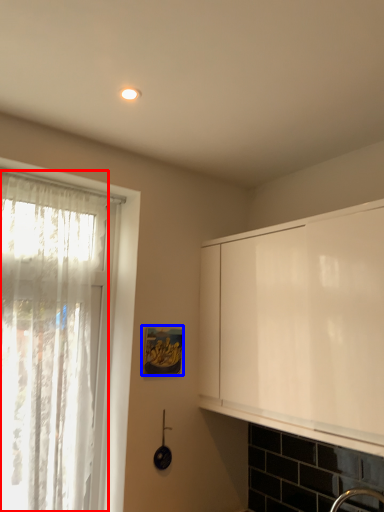
Question: Which object appears closest to the camera in this image, curtain (highlighted by a red box) or picture frame (highlighted by a blue box)?

Choices:
 (A) curtain
 (B) picture frame

Answer: (A)